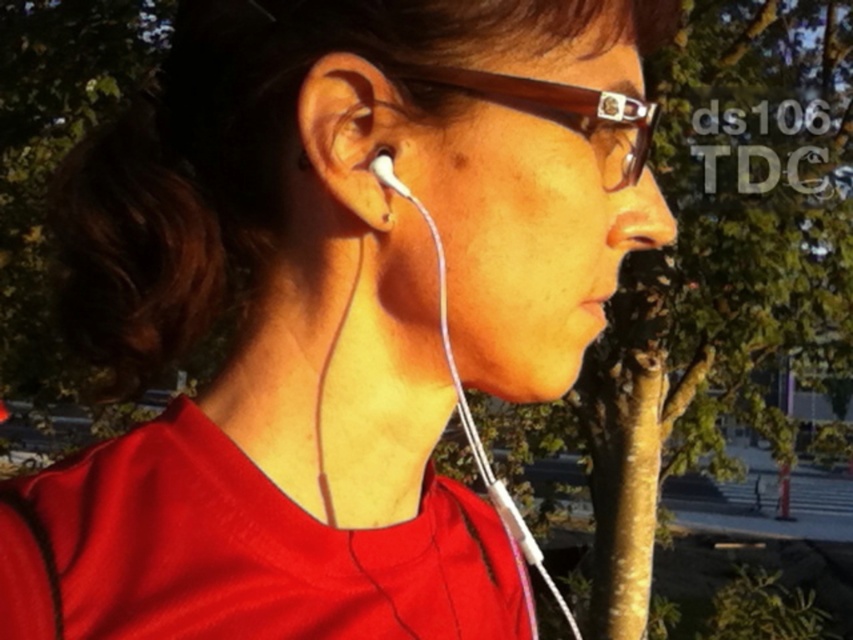
You are a photographer adjusting your camera to focus on two points in the image. The first point is point (317, 202) and the second point is point (378, 173). Which point is closer to your camera lens?

Point (317, 202) is further to the viewer than point (378, 173), so the point closer to the camera lens is point (378, 173).

You are a photographer trying to capture a portrait of the person in the scene. You notice the matte white earbud at center and the brown translucent glasses at upper center. Which object appears narrower in the photo?

The matte white earbud at center appears narrower than the brown translucent glasses at upper center because it has a lesser width compared to the glasses.

You are a photographer trying to capture a closeup of the person while ensuring both the brown textured tree trunk at center and the matte white earbud at center are visible in the frame. Which object should you focus on to ensure the one farther away remains in focus?

The brown textured tree trunk at center is taller than the matte white earbud at center, so focusing on the tree trunk would ensure the earbud stays in focus since it is closer.